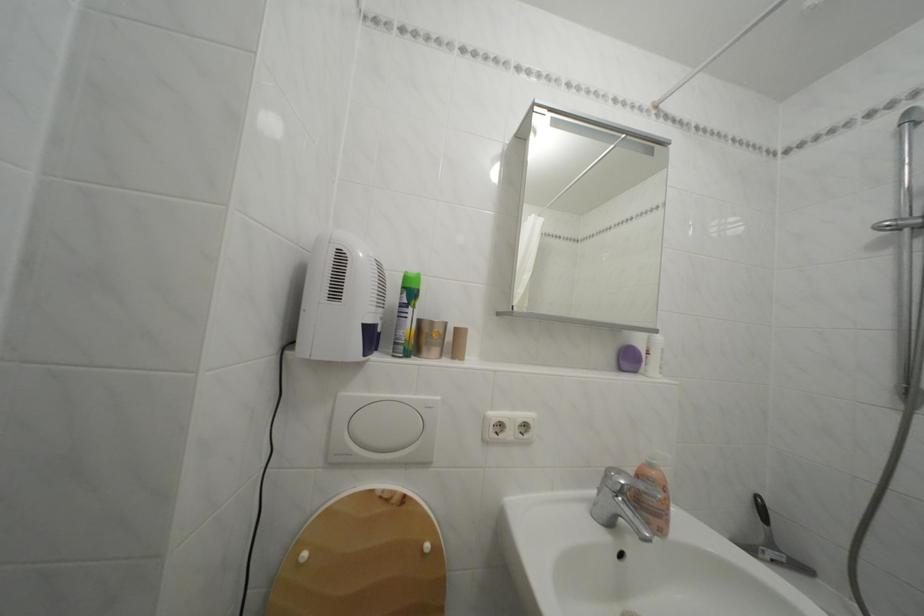
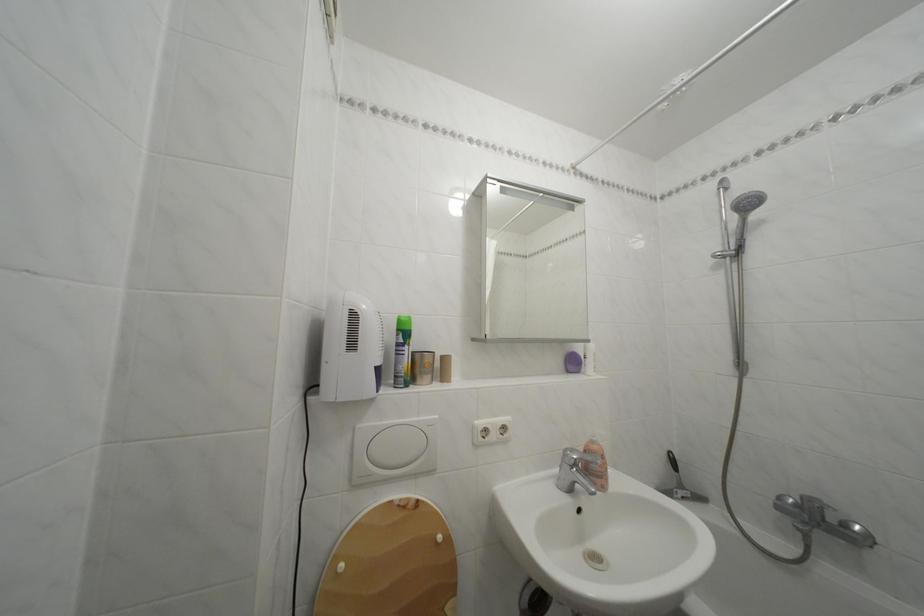
The point at (x=639, y=530) is marked in the first image. Where is the corresponding point in the second image?

(592, 492)